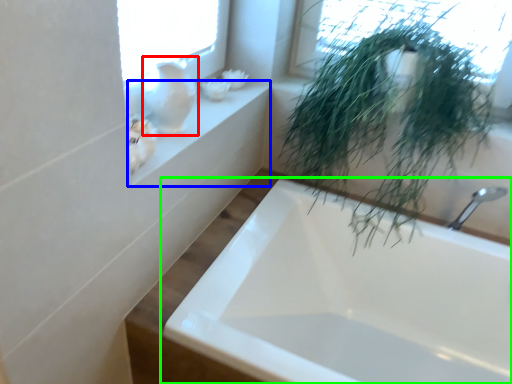
Question: Which is nearer to the glass vase (highlighted by a red box)? window sill (highlighted by a blue box) or bathtub (highlighted by a green box).

Choices:
 (A) window sill
 (B) bathtub

Answer: (A)